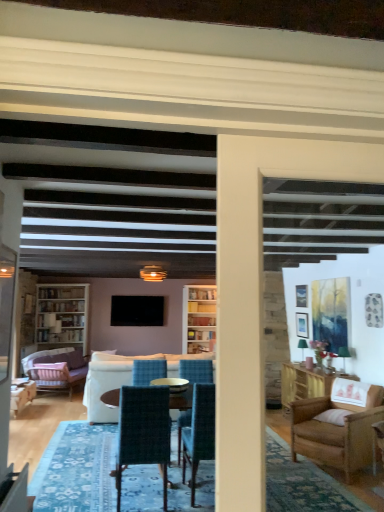
Question: Considering the relative sizes of velvet teal chair at center, the 2th chair viewed from the right, and velvet purple couch at left, the 2th studio couch positioned from the right, in the image provided, is velvet teal chair at center, the 2th chair viewed from the right, taller than velvet purple couch at left, the 2th studio couch positioned from the right,?

Choices:
 (A) no
 (B) yes

Answer: (B)

Question: Could velvet purple couch at left, which is counted as the 1th studio couch, starting from the left, be considered to be inside velvet teal chair at center, the first chair from the front?

Choices:
 (A) yes
 (B) no

Answer: (B)

Question: Does velvet teal chair at center, which is counted as the third chair, starting from the back, appear on the left side of velvet purple couch at left, which is counted as the 1th studio couch, starting from the left?

Choices:
 (A) yes
 (B) no

Answer: (B)

Question: Does velvet teal chair at center, which is counted as the third chair, starting from the back, appear on the right side of velvet purple couch at left, the 1th studio couch positioned from the back?

Choices:
 (A) no
 (B) yes

Answer: (B)

Question: Considering the relative positions of velvet teal chair at center, the first chair from the front, and velvet purple couch at left, which is counted as the 1th studio couch, starting from the left, in the image provided, is velvet teal chair at center, the first chair from the front, behind velvet purple couch at left, which is counted as the 1th studio couch, starting from the left,?

Choices:
 (A) yes
 (B) no

Answer: (B)

Question: Is velvet teal chair at center, the first chair from the front, outside of velvet purple couch at left, the second studio couch viewed from the front?

Choices:
 (A) yes
 (B) no

Answer: (A)

Question: Is velvet purple couch at left, the second studio couch viewed from the front, smaller than velvet pink armchair at lower left, which is counted as the 1th chair, starting from the back?

Choices:
 (A) yes
 (B) no

Answer: (B)

Question: From a real-world perspective, is velvet purple couch at left, the second studio couch viewed from the front, positioned over velvet pink armchair at lower left, the first chair viewed from the left, based on gravity?

Choices:
 (A) yes
 (B) no

Answer: (A)

Question: Can you see velvet purple couch at left, the 1th studio couch positioned from the back, touching velvet pink armchair at lower left, which is counted as the 1th chair, starting from the back?

Choices:
 (A) yes
 (B) no

Answer: (B)

Question: Can you confirm if velvet purple couch at left, the second studio couch viewed from the front, is bigger than velvet pink armchair at lower left, the first chair viewed from the left?

Choices:
 (A) yes
 (B) no

Answer: (A)

Question: Is velvet purple couch at left, the second studio couch viewed from the front, positioned with its back to velvet pink armchair at lower left, the first chair viewed from the left?

Choices:
 (A) no
 (B) yes

Answer: (A)

Question: Is the position of velvet purple couch at left, the second studio couch viewed from the front, more distant than that of velvet pink armchair at lower left, which is counted as the 1th chair, starting from the back?

Choices:
 (A) no
 (B) yes

Answer: (B)

Question: Does white wood bookcase at left have a greater height compared to velvet teal chair at center, which is counted as the third chair, starting from the back?

Choices:
 (A) yes
 (B) no

Answer: (A)